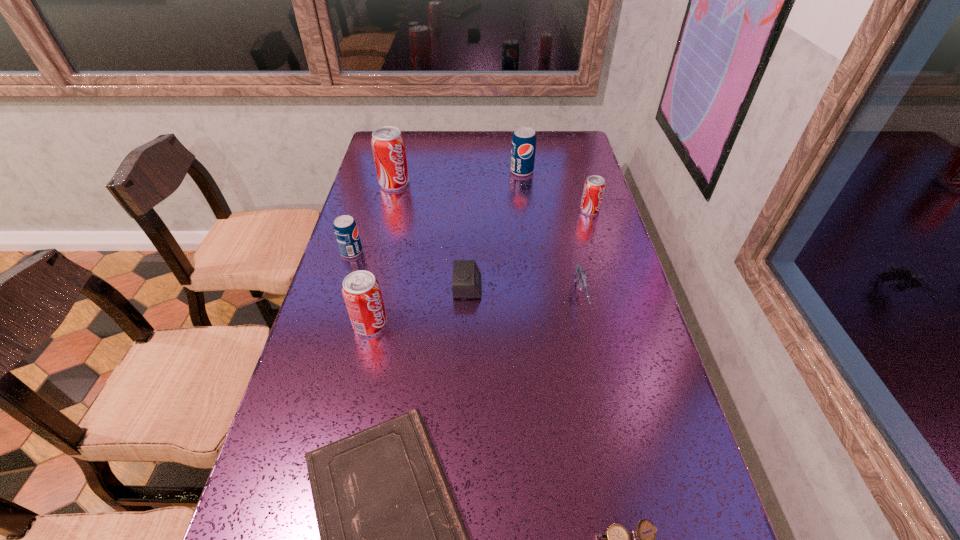
I want to click on the farthest red soda can, so click(x=388, y=146).

At what (x,y) coordinates should I click in order to perform the action: click on the tallest pop. Please return your answer as a coordinate pair (x, y). The width and height of the screenshot is (960, 540). Looking at the image, I should click on (388, 146).

Where is `the right blue pop`? the right blue pop is located at coordinates (523, 148).

Identify the location of the fourth object from right to left. The height and width of the screenshot is (540, 960). [523, 148].

The image size is (960, 540). I want to click on the nearest red soda can, so click(361, 290).

Identify the location of the second biggest red soda can. tap(361, 290).

At what (x,y) coordinates should I click in order to perform the action: click on the third nearest pop. Please return your answer as a coordinate pair (x, y). The image size is (960, 540). Looking at the image, I should click on (594, 186).

You are a GUI agent. You are given a task and a screenshot of the screen. Output one action in this format:
    pyautogui.click(x=<x>, y=<y>)
    Task: Click on the second nearest red soda can
    This screenshot has height=540, width=960.
    Given the screenshot: What is the action you would take?
    [594, 186]

Where is `the fourth farthest object`? This screenshot has width=960, height=540. the fourth farthest object is located at coordinates (345, 228).

The height and width of the screenshot is (540, 960). I want to click on the nearer blue pop, so click(x=345, y=228).